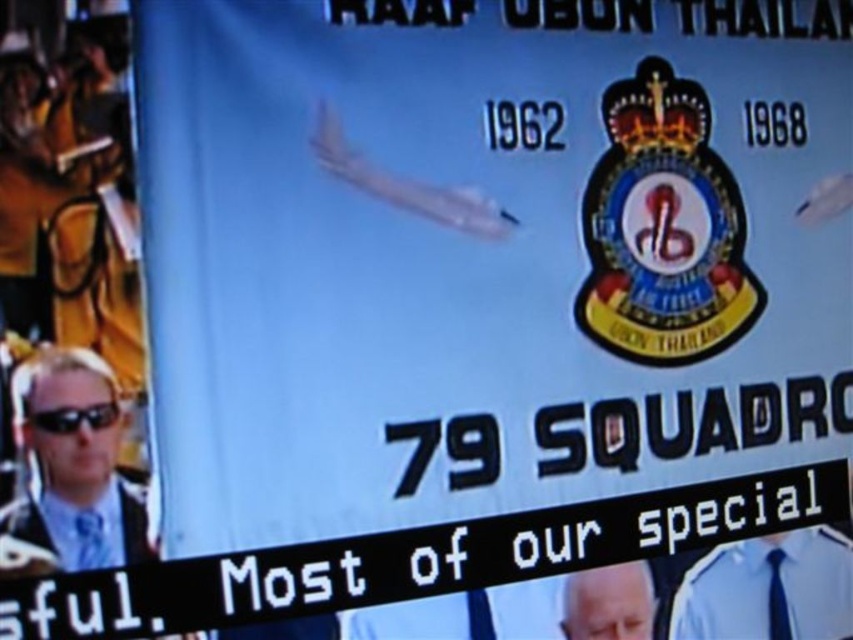
Who is shorter, blue shirt at center or blue fabric tie at lower left?

Standing shorter between the two is blue fabric tie at lower left.

Looking at this image, does blue shirt at center have a smaller size compared to blue fabric tie at lower left?

No.

Does point (815, 577) lie in front of point (91, 547)?

No.

Locate an element on the screen. The height and width of the screenshot is (640, 853). blue shirt at center is located at coordinates (769, 589).

Consider the image. Is gray hair at center taller than black plastic goggles at lower left?

Yes, gray hair at center is taller than black plastic goggles at lower left.

What do you see at coordinates (608, 602) in the screenshot?
I see `gray hair at center` at bounding box center [608, 602].

Is point (618, 582) positioned before point (86, 419)?

No.

Image resolution: width=853 pixels, height=640 pixels. What are the coordinates of `gray hair at center` in the screenshot? It's located at (608, 602).

In the scene shown: Between blue shirt at center and blue fabric tie at lower center, which one appears on the left side from the viewer's perspective?

Positioned to the left is blue fabric tie at lower center.

Who is taller, blue shirt at center or blue fabric tie at lower center?

blue shirt at center is taller.

Identify the location of blue shirt at center. The image size is (853, 640). (769, 589).